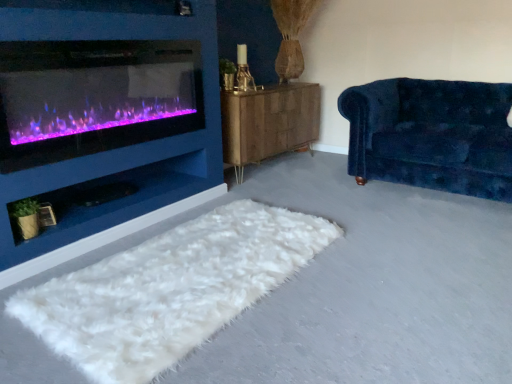
Identify the location of free spot to the right of white fluffy rug at lower center. The image size is (512, 384). (397, 278).